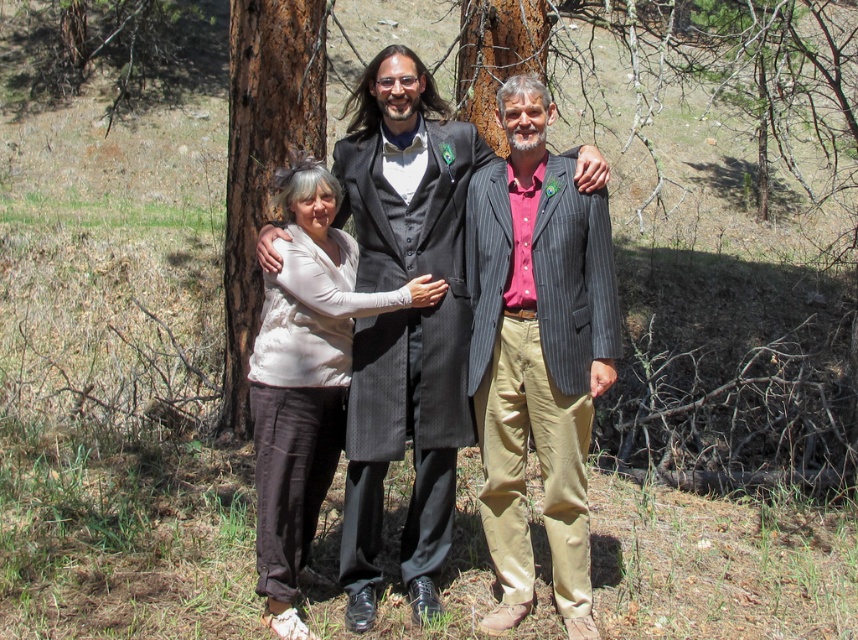
Question: Can you confirm if matte beige blouse at center is smaller than brown rough bark tree at left?

Choices:
 (A) yes
 (B) no

Answer: (A)

Question: Which of the following is the closest to the observer?

Choices:
 (A) matte black suit at center
 (B) striped wool blazer at center
 (C) matte beige blouse at center

Answer: (B)

Question: In this image, where is matte beige blouse at center located relative to brown rough bark tree at left?

Choices:
 (A) right
 (B) left

Answer: (A)

Question: Which point appears farthest from the camera in this image?

Choices:
 (A) (409, 403)
 (B) (273, 624)
 (C) (224, 282)

Answer: (C)

Question: Does striped wool blazer at center have a smaller size compared to matte black suit at center?

Choices:
 (A) no
 (B) yes

Answer: (B)

Question: Which object appears farthest from the camera in this image?

Choices:
 (A) striped wool blazer at center
 (B) brown rough bark tree at left

Answer: (B)